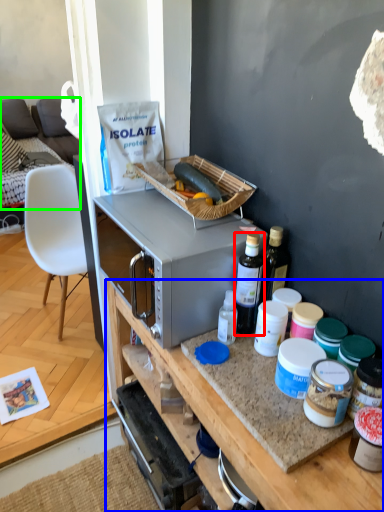
Question: Which is nearer to the bottle (highlighted by a red box)? desk (highlighted by a blue box) or cabinetry (highlighted by a green box).

Choices:
 (A) desk
 (B) cabinetry

Answer: (A)